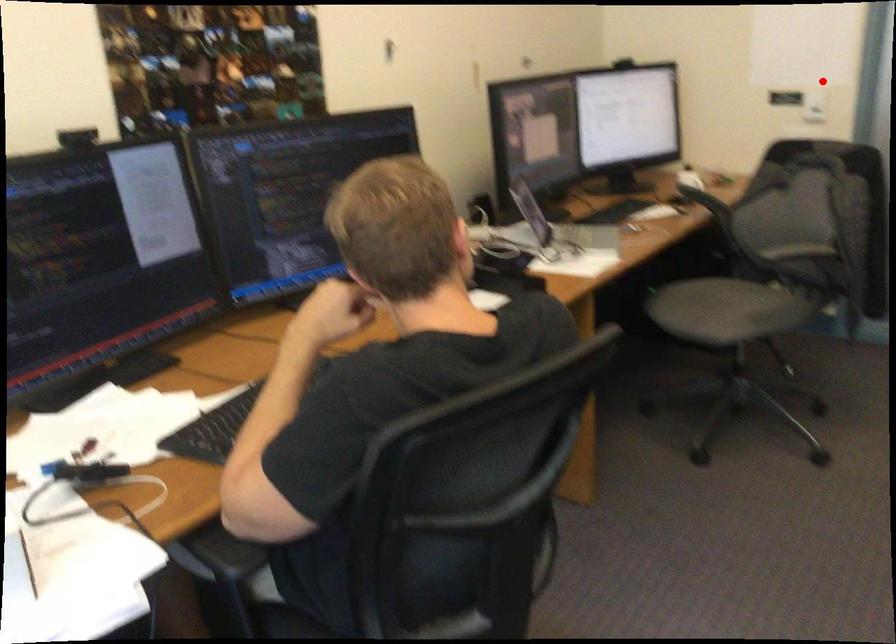
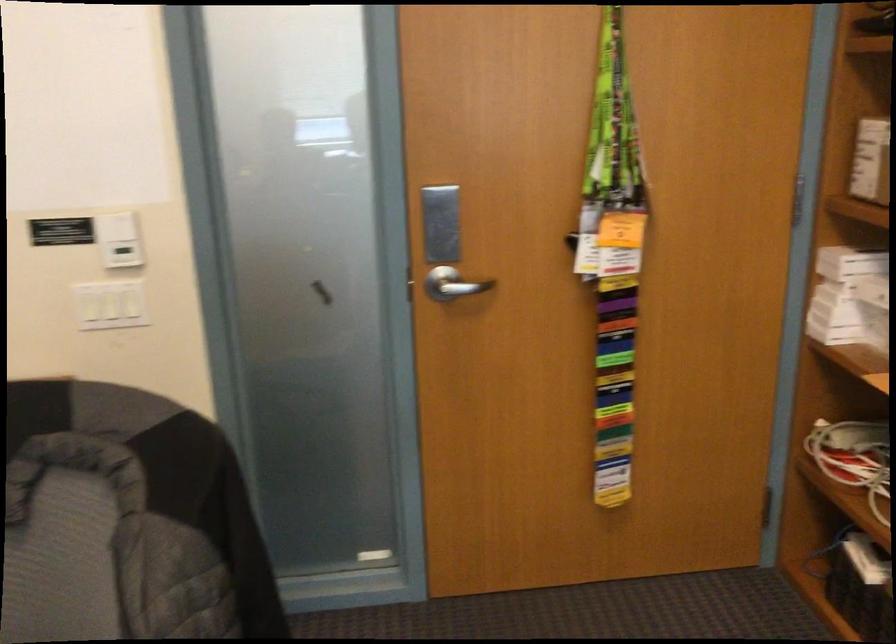
In the second image, find the point that corresponds to the highlighted location in the first image.

(116, 225)